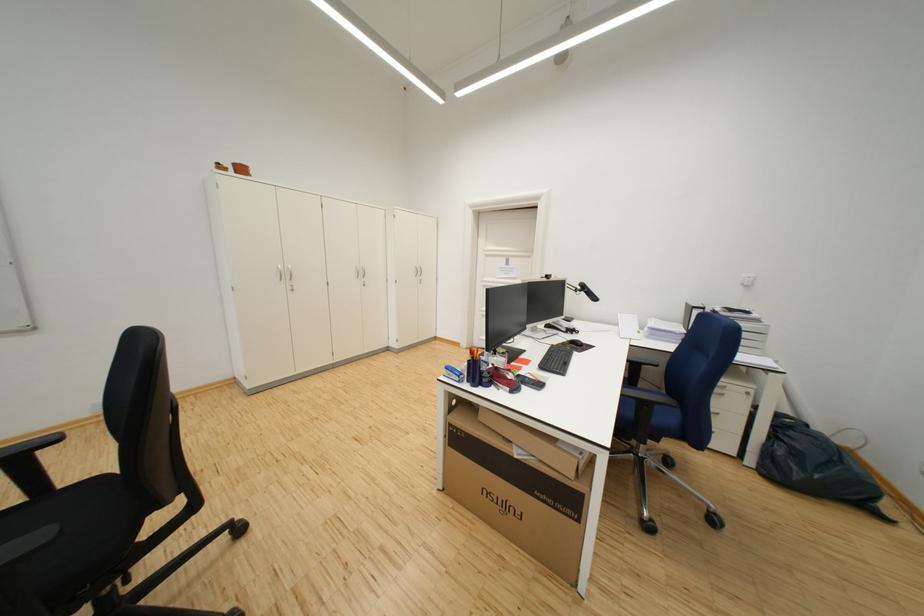
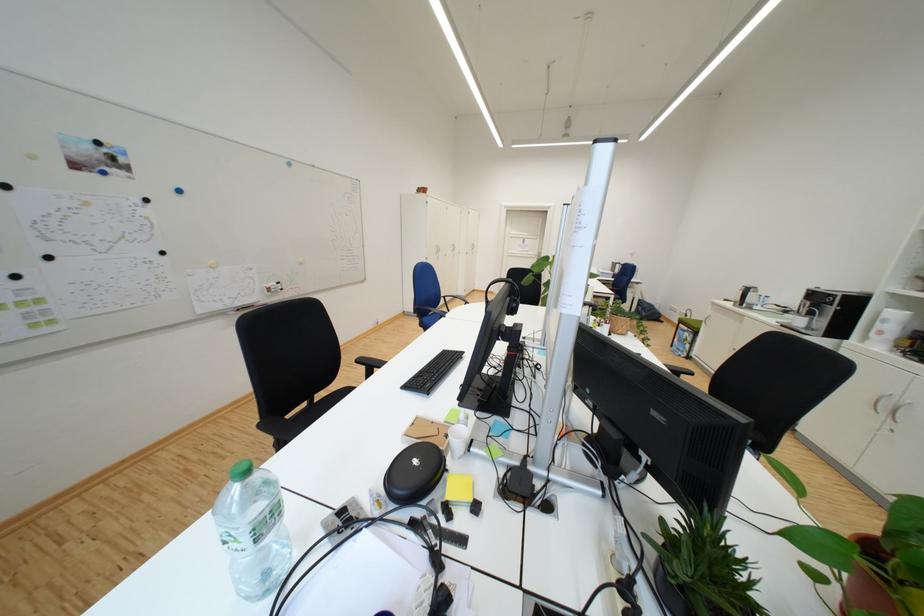
In a continuous first-person perspective shot, in which direction is the camera moving?

The movement direction of the cameraman is left, backward.